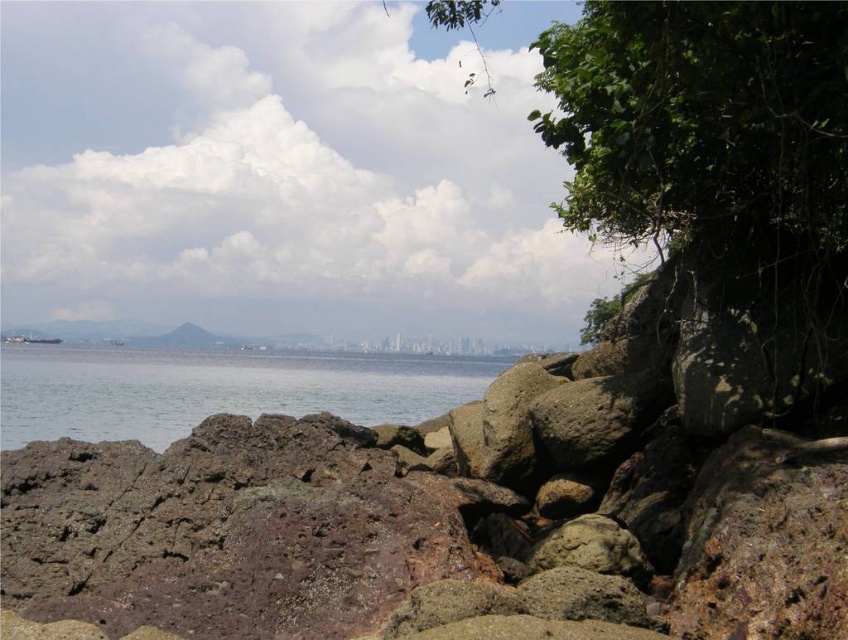
You are standing at the point with coordinates point (296, 355) and want to walk to the point with coordinates point (657, 548). Which direction should you move in?

You should move forward because point (657, 548) is in front of point (296, 355).

You are standing on the brown rough rocks at center and want to reach the clear water at center. Which direction should you move to get to the water?

Since the brown rough rocks at center are in front of the clear water at center, you should move backward to reach the clear water at center.

You are standing at the edge of the rocky shoreline and want to place a small decorative statue on the brown rough rocks at center so that it doesn not get wet from the clear water at center. Is this possible?

The brown rough rocks at center are positioned over the clear water at center, so placing the statue there would still keep it above the water and prevent it from getting wet.